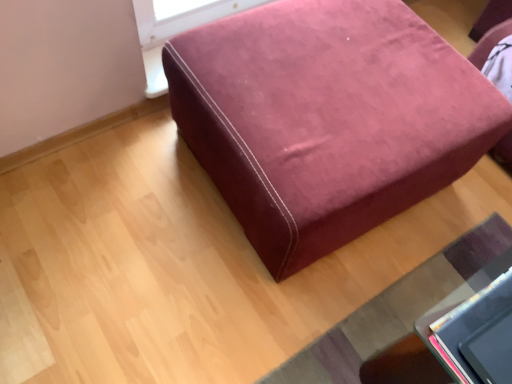
Question: From a real-world perspective, is velvet-like burgundy ottoman at center positioned under velvet-like burgundy ottoman at lower right based on gravity?

Choices:
 (A) yes
 (B) no

Answer: (B)

Question: Is velvet-like burgundy ottoman at center beside velvet-like burgundy ottoman at lower right?

Choices:
 (A) no
 (B) yes

Answer: (A)

Question: Is velvet-like burgundy ottoman at center positioned before velvet-like burgundy ottoman at lower right?

Choices:
 (A) yes
 (B) no

Answer: (A)

Question: Is velvet-like burgundy ottoman at center thinner than velvet-like burgundy ottoman at lower right?

Choices:
 (A) no
 (B) yes

Answer: (A)

Question: Is velvet-like burgundy ottoman at center far away from velvet-like burgundy ottoman at lower right?

Choices:
 (A) no
 (B) yes

Answer: (A)

Question: Is velvet-like burgundy ottoman at center at the left side of velvet-like burgundy ottoman at lower right?

Choices:
 (A) yes
 (B) no

Answer: (A)

Question: Can you confirm if velvet-like burgundy ottoman at lower right is thinner than velvet-like burgundy ottoman at center?

Choices:
 (A) yes
 (B) no

Answer: (A)

Question: Could you tell me if velvet-like burgundy ottoman at lower right is facing velvet-like burgundy ottoman at center?

Choices:
 (A) yes
 (B) no

Answer: (B)

Question: Is velvet-like burgundy ottoman at lower right outside velvet-like burgundy ottoman at center?

Choices:
 (A) no
 (B) yes

Answer: (B)

Question: Is there a large distance between velvet-like burgundy ottoman at lower right and velvet-like burgundy ottoman at center?

Choices:
 (A) no
 (B) yes

Answer: (A)

Question: From the image's perspective, is velvet-like burgundy ottoman at lower right over velvet-like burgundy ottoman at center?

Choices:
 (A) no
 (B) yes

Answer: (A)

Question: Is velvet-like burgundy ottoman at lower right at the right side of velvet-like burgundy ottoman at center?

Choices:
 (A) no
 (B) yes

Answer: (B)

Question: In the image, is velvet-like burgundy ottoman at center on the left side or the right side of velvet-like burgundy ottoman at lower right?

Choices:
 (A) right
 (B) left

Answer: (B)